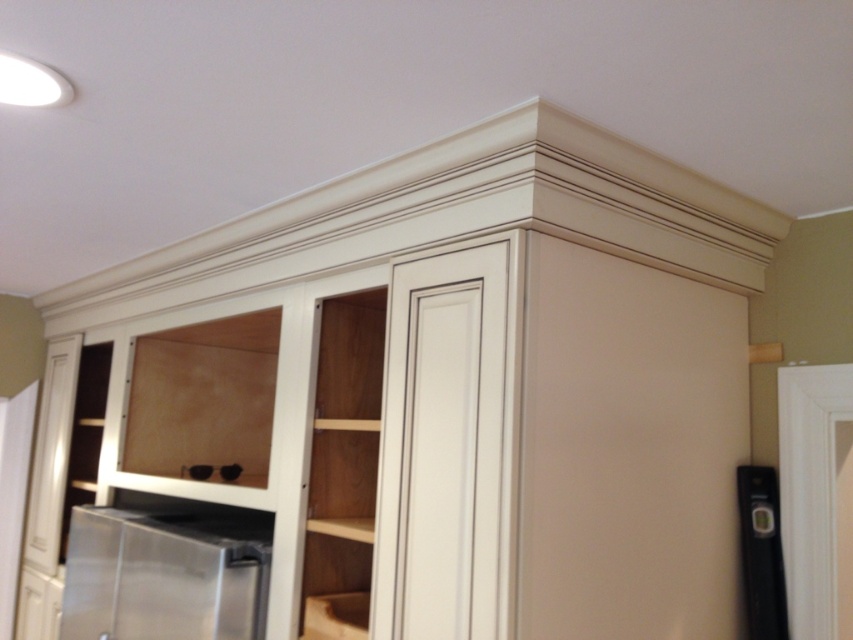
What are the coordinates of `stainless steel refrigerator at lower left` in the screenshot? It's located at (165, 573).

Is stainless steel refrigerator at lower left bigger than black plastic level at lower right?

Yes, stainless steel refrigerator at lower left is bigger than black plastic level at lower right.

Is point (233, 577) less distant than point (741, 500)?

No, it is behind (741, 500).

The height and width of the screenshot is (640, 853). Find the location of `stainless steel refrigerator at lower left`. stainless steel refrigerator at lower left is located at coordinates (165, 573).